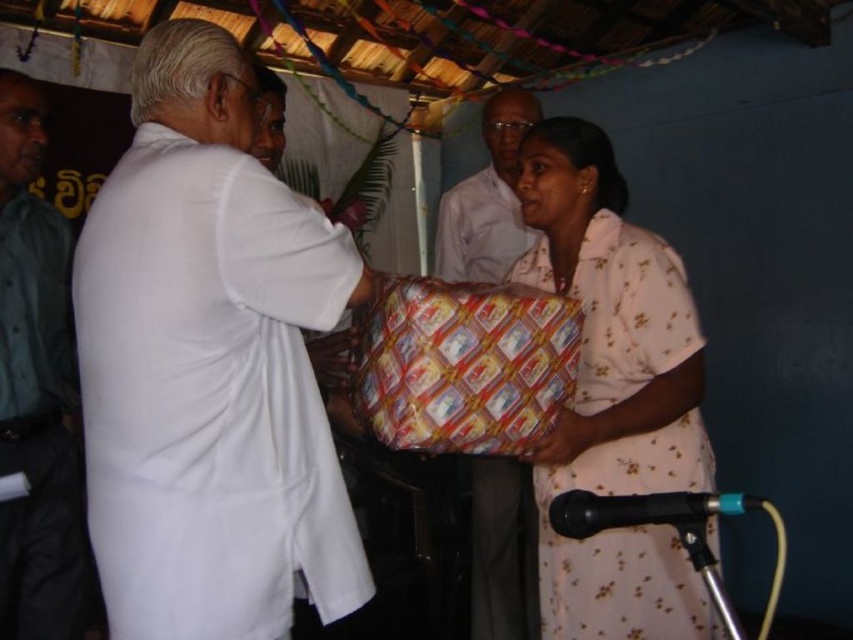
Question: Which of the following is the closest to the observer?

Choices:
 (A) (440, 285)
 (B) (468, 248)
 (C) (32, 440)

Answer: (A)

Question: Is patterned paper package at center positioned behind matte white shirt at center?

Choices:
 (A) yes
 (B) no

Answer: (B)

Question: Which of the following is the closest to the observer?

Choices:
 (A) (173, 83)
 (B) (22, 440)
 (C) (520, 193)

Answer: (A)

Question: Which point is farther to the camera?

Choices:
 (A) green uniform shirt at left
 (B) pink floral dress at center

Answer: (A)

Question: Does pink floral dress at center have a lesser width compared to patterned paper package at center?

Choices:
 (A) yes
 (B) no

Answer: (A)

Question: Does patterned paper package at center have a lesser width compared to matte white shirt at center?

Choices:
 (A) yes
 (B) no

Answer: (B)